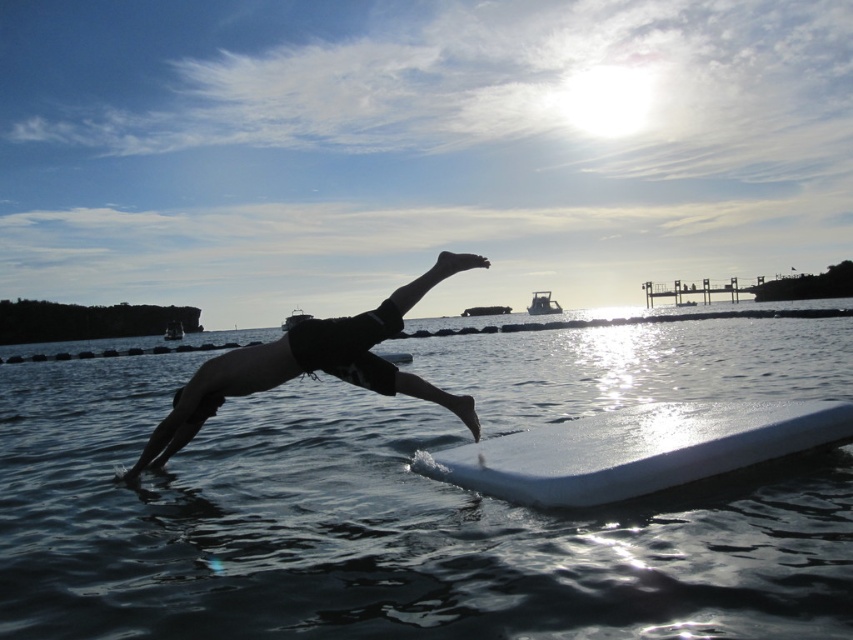
Question: Is transparent water at center in front of black matte shorts at center?

Choices:
 (A) yes
 (B) no

Answer: (A)

Question: Based on their relative distances, which object is farther from the black matte shorts at center?

Choices:
 (A) transparent water at center
 (B) white foam surfboard at center

Answer: (A)

Question: Does transparent water at center come behind black matte shorts at center?

Choices:
 (A) yes
 (B) no

Answer: (B)

Question: Is transparent water at center to the left of white foam surfboard at center from the viewer's perspective?

Choices:
 (A) no
 (B) yes

Answer: (B)

Question: Which object appears closest to the camera in this image?

Choices:
 (A) black matte shorts at center
 (B) white foam surfboard at center
 (C) transparent water at center

Answer: (C)

Question: Which object appears closest to the camera in this image?

Choices:
 (A) white foam surfboard at center
 (B) black matte shorts at center

Answer: (A)